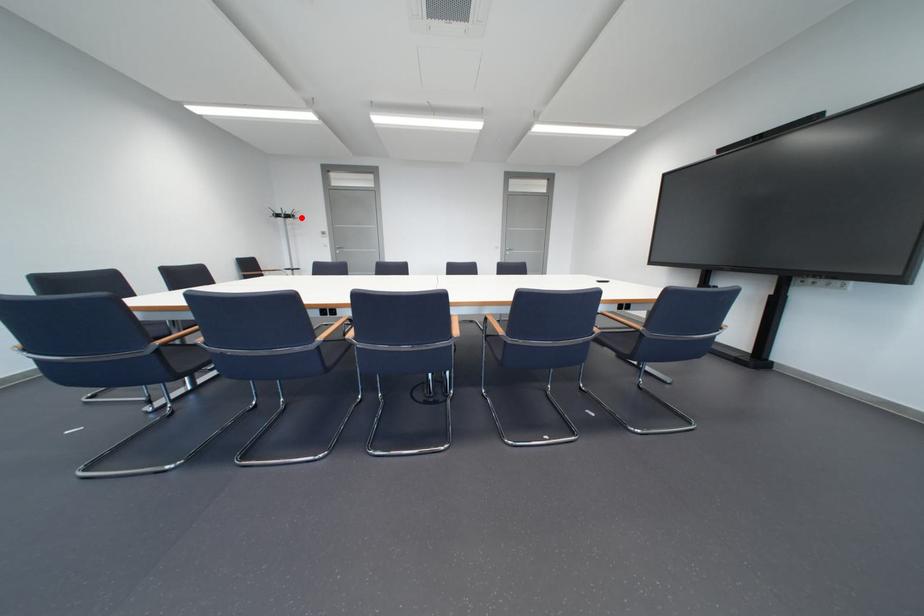
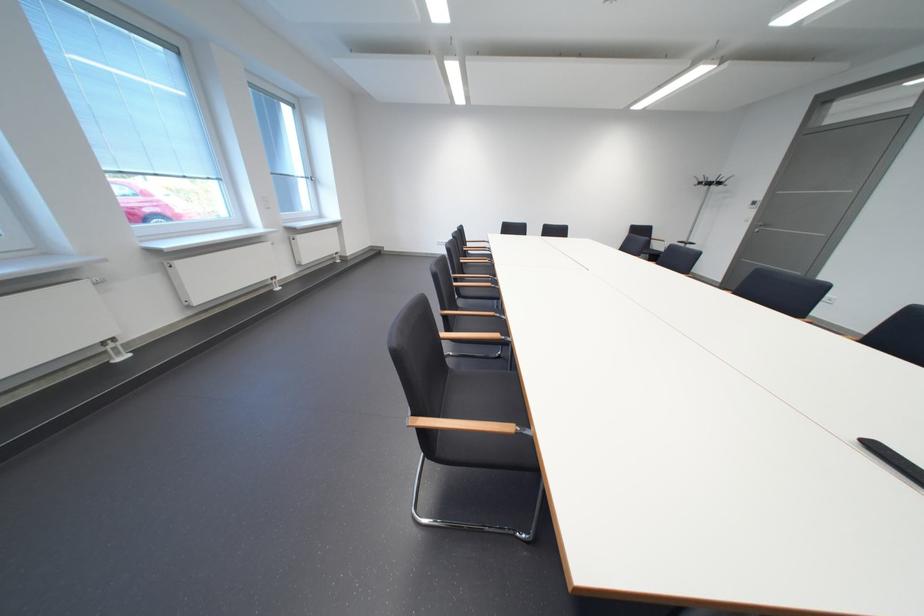
Question: A red point is marked in image1. In image2, is the corresponding 3D point closer to the camera or farther? Reply with the corresponding letter.

Choices:
 (A) The corresponding 3D point is closer.
 (B) The corresponding 3D point is farther.

Answer: (B)